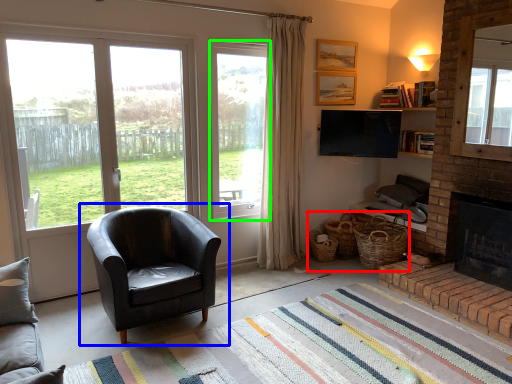
Question: Based on their relative distances, which object is nearer to basket (highlighted by a red box)? Choose from chair (highlighted by a blue box) and window (highlighted by a green box).

Choices:
 (A) chair
 (B) window

Answer: (B)